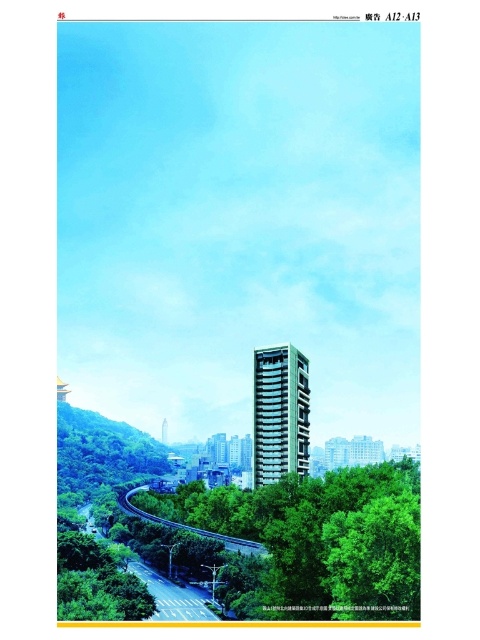
You are a city planner analyzing the urban layout. Given the green leafy tree at lower center and the sandy beige concrete building at center, which object occupies more horizontal space in the scene?

The green leafy tree at lower center occupies more horizontal space than the sandy beige concrete building at center because its width surpasses the building.

You are standing on the sidewalk and want to take a photo of the sandy beige concrete building at center. However, there is a green leafy tree at lower center blocking your view. Can you move to the left or right to avoid the tree?

The green leafy tree at lower center is closer to the viewer than the sandy beige concrete building at center, so moving to the left or right may help you avoid the tree and get a clear view of the building.